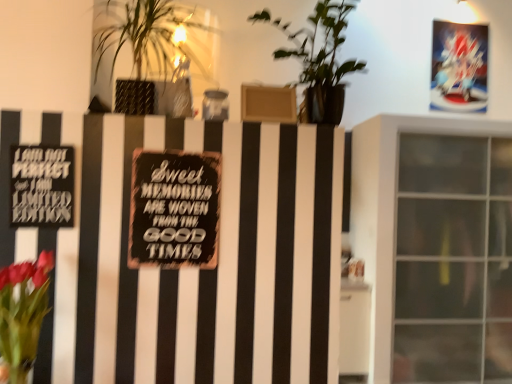
Question: Is green leafy plant at upper left, acting as the first houseplant starting from the left, taller than green leafy plant at center, which is counted as the second houseplant, starting from the left?

Choices:
 (A) no
 (B) yes

Answer: (A)

Question: Does green leafy plant at upper left, acting as the first houseplant starting from the left, come behind green leafy plant at center, which is counted as the first houseplant, starting from the right?

Choices:
 (A) no
 (B) yes

Answer: (B)

Question: Is green leafy plant at upper left, which appears as the second houseplant when viewed from the right, at the right side of green leafy plant at center, which is counted as the second houseplant, starting from the left?

Choices:
 (A) no
 (B) yes

Answer: (A)

Question: Considering the relative sizes of green leafy plant at upper left, which appears as the second houseplant when viewed from the right, and green leafy plant at center, which is counted as the second houseplant, starting from the left, in the image provided, is green leafy plant at upper left, which appears as the second houseplant when viewed from the right, thinner than green leafy plant at center, which is counted as the second houseplant, starting from the left,?

Choices:
 (A) yes
 (B) no

Answer: (A)

Question: Are green leafy plant at upper left, which appears as the second houseplant when viewed from the right, and green leafy plant at center, which is counted as the first houseplant, starting from the right, far apart?

Choices:
 (A) no
 (B) yes

Answer: (B)

Question: Is green leafy plant at upper left, which appears as the second houseplant when viewed from the right, smaller than green leafy plant at center, which is counted as the first houseplant, starting from the right?

Choices:
 (A) yes
 (B) no

Answer: (A)

Question: Considering the relative positions of transparent glass window at right and vivid pink petals at lower left in the image provided, is transparent glass window at right to the left of vivid pink petals at lower left from the viewer's perspective?

Choices:
 (A) yes
 (B) no

Answer: (B)

Question: Would you say transparent glass window at right is a long distance from vivid pink petals at lower left?

Choices:
 (A) yes
 (B) no

Answer: (A)

Question: Is transparent glass window at right positioned beyond the bounds of vivid pink petals at lower left?

Choices:
 (A) no
 (B) yes

Answer: (B)

Question: Is transparent glass window at right oriented away from vivid pink petals at lower left?

Choices:
 (A) yes
 (B) no

Answer: (B)

Question: Is transparent glass window at right with vivid pink petals at lower left?

Choices:
 (A) yes
 (B) no

Answer: (B)

Question: Considering the relative sizes of transparent glass window at right and vivid pink petals at lower left in the image provided, is transparent glass window at right thinner than vivid pink petals at lower left?

Choices:
 (A) yes
 (B) no

Answer: (B)

Question: Is black matte sign at left, the second plaque in the back-to-front sequence, at the left side of green leafy plant at upper left, acting as the first houseplant starting from the left?

Choices:
 (A) yes
 (B) no

Answer: (A)